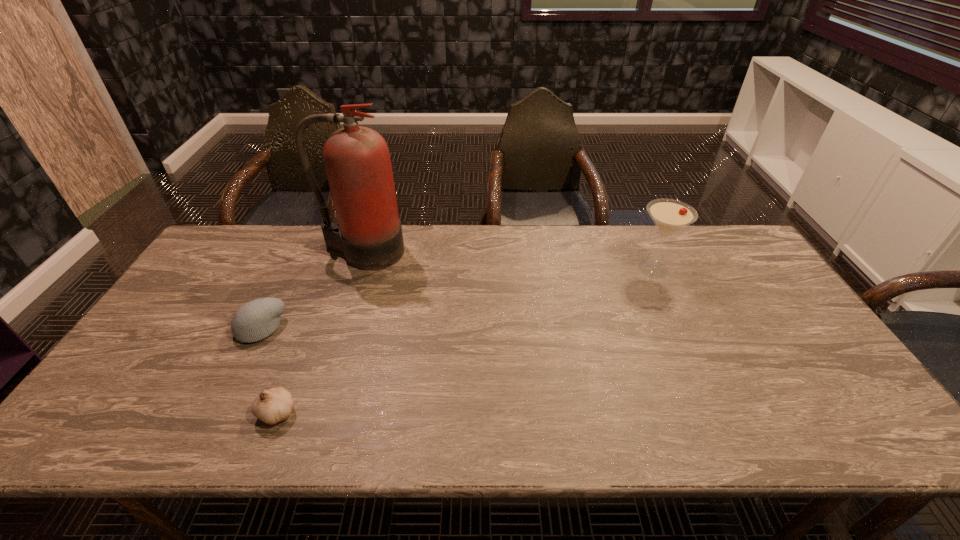
The image size is (960, 540). I want to click on free space that satisfies the following two spatial constraints: 1. at the nozzle of the tallest object; 2. on the right side of the martini, so click(357, 269).

In order to click on vacant space that satisfies the following two spatial constraints: 1. at the nozzle of the second tallest object; 2. on the right side of the fire extinguisher in this screenshot , I will do `click(357, 269)`.